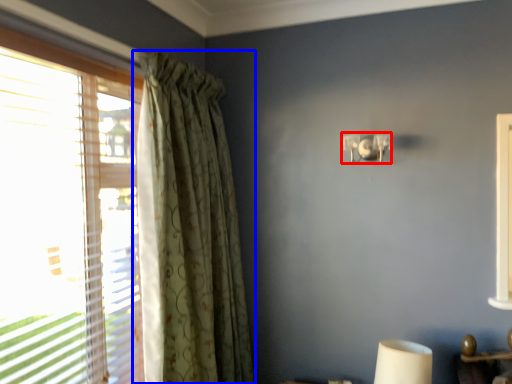
Question: Which object appears farthest to the camera in this image, lamp (highlighted by a red box) or curtain (highlighted by a blue box)?

Choices:
 (A) lamp
 (B) curtain

Answer: (A)